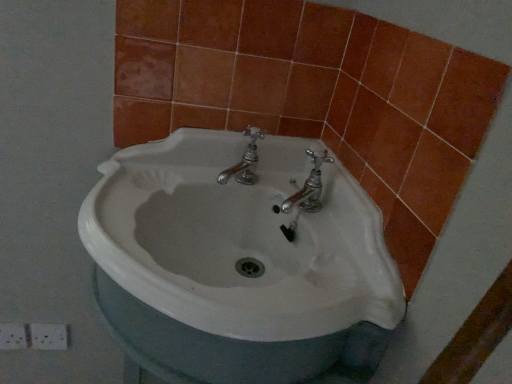
I want to click on orange ceramic tile at lower left, acting as the second ceramic tile starting from the left, so click(x=49, y=336).

Locate an element on the screen. orange matte tile at upper right, which is the second ceramic tile in right-to-left order is located at coordinates tap(12, 336).

Does orange ceramic tile at lower left, acting as the second ceramic tile starting from the left, have a lesser width compared to orange matte tile at upper right, which is the second ceramic tile in right-to-left order?

Indeed, orange ceramic tile at lower left, acting as the second ceramic tile starting from the left, has a lesser width compared to orange matte tile at upper right, which is the second ceramic tile in right-to-left order.

From a real-world perspective, is orange ceramic tile at lower left, acting as the second ceramic tile starting from the left, on orange matte tile at upper right, positioned as the first ceramic tile in left-to-right order?

Indeed, from a real-world perspective, orange ceramic tile at lower left, acting as the second ceramic tile starting from the left, stands above orange matte tile at upper right, positioned as the first ceramic tile in left-to-right order.

How far apart are orange ceramic tile at lower left, acting as the second ceramic tile starting from the left, and orange matte tile at upper right, positioned as the first ceramic tile in left-to-right order?

orange ceramic tile at lower left, acting as the second ceramic tile starting from the left, is 2.17 inches from orange matte tile at upper right, positioned as the first ceramic tile in left-to-right order.

Is orange ceramic tile at lower left, which ranks as the first ceramic tile in right-to-left order, bigger or smaller than orange matte tile at upper right, positioned as the first ceramic tile in left-to-right order?

Considering their sizes, orange ceramic tile at lower left, which ranks as the first ceramic tile in right-to-left order, takes up less space than orange matte tile at upper right, positioned as the first ceramic tile in left-to-right order.

Is orange matte tile at upper right, which is the second ceramic tile in right-to-left order, facing away from orange ceramic tile at lower left, acting as the second ceramic tile starting from the left?

No, orange matte tile at upper right, which is the second ceramic tile in right-to-left order, is not facing away from orange ceramic tile at lower left, acting as the second ceramic tile starting from the left.

Identify the location of ceramic tile behind the orange matte tile at upper right, which is the second ceramic tile in right-to-left order. 49,336.

Does point (19, 343) come behind point (53, 338)?

That is False.

Would you say orange matte tile at upper right, positioned as the first ceramic tile in left-to-right order, is a long distance from orange ceramic tile at lower left, which ranks as the first ceramic tile in right-to-left order?

orange matte tile at upper right, positioned as the first ceramic tile in left-to-right order, is actually quite close to orange ceramic tile at lower left, which ranks as the first ceramic tile in right-to-left order.

Looking at the image, does white ceramic sink at center seem bigger or smaller compared to orange ceramic tile at lower left, which ranks as the first ceramic tile in right-to-left order?

Considering their sizes, white ceramic sink at center takes up more space than orange ceramic tile at lower left, which ranks as the first ceramic tile in right-to-left order.

From the image's perspective, which one is positioned lower, white ceramic sink at center or orange ceramic tile at lower left, which ranks as the first ceramic tile in right-to-left order?

white ceramic sink at center, from the image's perspective.

Is point (142, 181) in front of point (44, 348)?

Yes, it is.

Does white ceramic sink at center have a lesser height compared to orange matte tile at upper right, positioned as the first ceramic tile in left-to-right order?

No, white ceramic sink at center is not shorter than orange matte tile at upper right, positioned as the first ceramic tile in left-to-right order.

Does white ceramic sink at center touch orange matte tile at upper right, which is the second ceramic tile in right-to-left order?

No, white ceramic sink at center is not beside orange matte tile at upper right, which is the second ceramic tile in right-to-left order.

Find the location of a particular element. This screenshot has height=384, width=512. sink that appears on the right of orange matte tile at upper right, positioned as the first ceramic tile in left-to-right order is located at coordinates (240, 239).

Is white ceramic sink at center wider or thinner than orange matte tile at upper right, positioned as the first ceramic tile in left-to-right order?

white ceramic sink at center is wider than orange matte tile at upper right, positioned as the first ceramic tile in left-to-right order.

Which is nearer, (39,340) or (184,275)?

The point (184,275) is more forward.

From the image's perspective, is orange ceramic tile at lower left, which ranks as the first ceramic tile in right-to-left order, under white ceramic sink at center?

No, from the image's perspective, orange ceramic tile at lower left, which ranks as the first ceramic tile in right-to-left order, is not beneath white ceramic sink at center.

Based on the photo, considering the sizes of objects orange ceramic tile at lower left, acting as the second ceramic tile starting from the left, and white ceramic sink at center in the image provided, who is shorter, orange ceramic tile at lower left, acting as the second ceramic tile starting from the left, or white ceramic sink at center?

orange ceramic tile at lower left, acting as the second ceramic tile starting from the left.

From a real-world perspective, which is physically below, orange matte tile at upper right, which is the second ceramic tile in right-to-left order, or white ceramic sink at center?

orange matte tile at upper right, which is the second ceramic tile in right-to-left order, is physically lower.

Is orange matte tile at upper right, positioned as the first ceramic tile in left-to-right order, in front of or behind white ceramic sink at center in the image?

orange matte tile at upper right, positioned as the first ceramic tile in left-to-right order, is behind white ceramic sink at center.

Can you confirm if orange matte tile at upper right, which is the second ceramic tile in right-to-left order, is taller than white ceramic sink at center?

In fact, orange matte tile at upper right, which is the second ceramic tile in right-to-left order, may be shorter than white ceramic sink at center.

Consider the image. Does orange matte tile at upper right, which is the second ceramic tile in right-to-left order, contain white ceramic sink at center?

No, orange matte tile at upper right, which is the second ceramic tile in right-to-left order, does not contain white ceramic sink at center.

You are a GUI agent. You are given a task and a screenshot of the screen. Output one action in this format:
    pyautogui.click(x=<x>, y=<y>)
    Task: Click on the ceramic tile behind the orange matte tile at upper right, positioned as the first ceramic tile in left-to-right order
    
    Given the screenshot: What is the action you would take?
    pyautogui.click(x=49, y=336)

At what (x,y) coordinates should I click in order to perform the action: click on ceramic tile below the orange ceramic tile at lower left, which ranks as the first ceramic tile in right-to-left order (from a real-world perspective). Please return your answer as a coordinate pair (x, y). This screenshot has height=384, width=512. Looking at the image, I should click on (12, 336).

Estimate the real-world distances between objects in this image. Which object is further from white ceramic sink at center, orange ceramic tile at lower left, acting as the second ceramic tile starting from the left, or orange matte tile at upper right, positioned as the first ceramic tile in left-to-right order?

The object further to white ceramic sink at center is orange matte tile at upper right, positioned as the first ceramic tile in left-to-right order.

Estimate the real-world distances between objects in this image. Which object is further from orange matte tile at upper right, which is the second ceramic tile in right-to-left order, white ceramic sink at center or orange ceramic tile at lower left, acting as the second ceramic tile starting from the left?

white ceramic sink at center is positioned further to the anchor orange matte tile at upper right, which is the second ceramic tile in right-to-left order.

Estimate the real-world distances between objects in this image. Which object is closer to orange ceramic tile at lower left, which ranks as the first ceramic tile in right-to-left order, orange matte tile at upper right, positioned as the first ceramic tile in left-to-right order, or white ceramic sink at center?

The object closer to orange ceramic tile at lower left, which ranks as the first ceramic tile in right-to-left order, is orange matte tile at upper right, positioned as the first ceramic tile in left-to-right order.

Considering their positions, is orange matte tile at upper right, which is the second ceramic tile in right-to-left order, positioned further to white ceramic sink at center than orange ceramic tile at lower left, which ranks as the first ceramic tile in right-to-left order?

orange matte tile at upper right, which is the second ceramic tile in right-to-left order, is positioned further to the anchor white ceramic sink at center.

Based on their spatial positions, is white ceramic sink at center or orange matte tile at upper right, positioned as the first ceramic tile in left-to-right order, closer to orange ceramic tile at lower left, which ranks as the first ceramic tile in right-to-left order?

orange matte tile at upper right, positioned as the first ceramic tile in left-to-right order, is positioned closer to the anchor orange ceramic tile at lower left, which ranks as the first ceramic tile in right-to-left order.

Based on their spatial positions, is orange ceramic tile at lower left, which ranks as the first ceramic tile in right-to-left order, or white ceramic sink at center further from orange matte tile at upper right, which is the second ceramic tile in right-to-left order?

white ceramic sink at center.

Image resolution: width=512 pixels, height=384 pixels. Find the location of `ceramic tile between white ceramic sink at center and orange ceramic tile at lower left, acting as the second ceramic tile starting from the left, in the front-back direction`. ceramic tile between white ceramic sink at center and orange ceramic tile at lower left, acting as the second ceramic tile starting from the left, in the front-back direction is located at coordinates (12, 336).